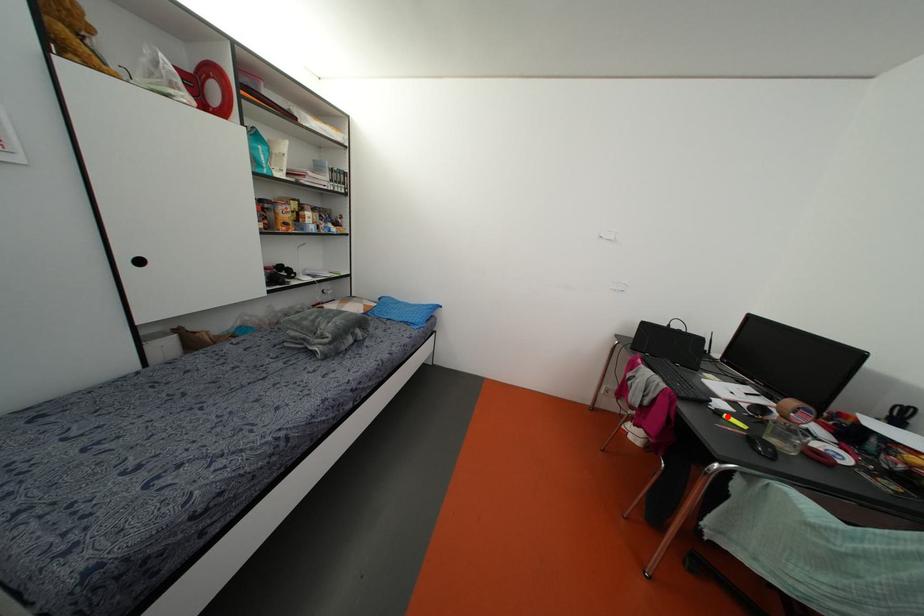
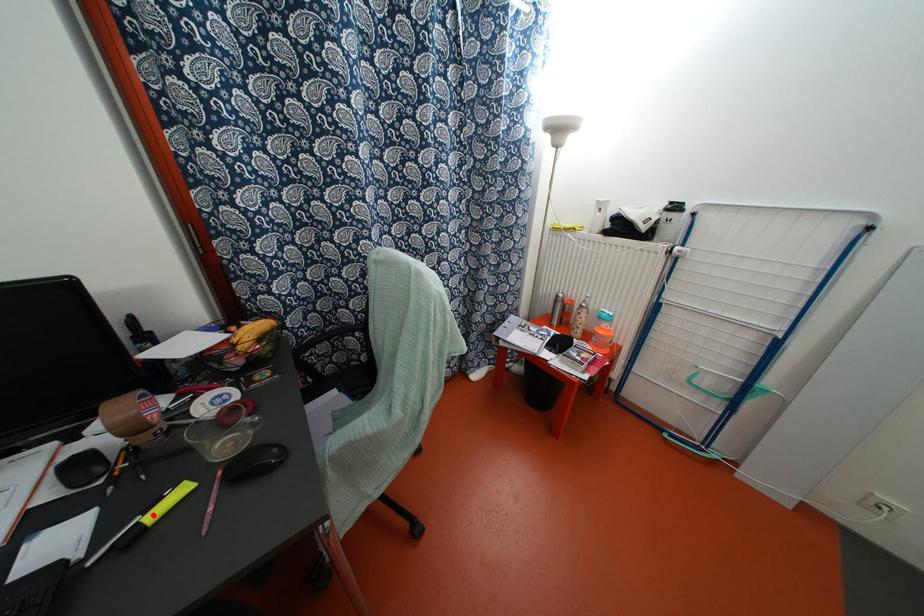
I am providing you with two images of the same scene from different viewpoints. A red point is marked on the first image and another point is marked on the second image. Are the points marked in image1 and image2 representing the same 3D position?

Yes